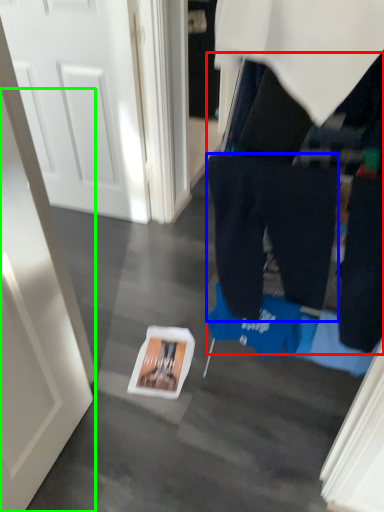
Question: Which object is positioned closest to tight (highlighted by a red box)? Select from trousers (highlighted by a blue box) and door (highlighted by a green box).

Choices:
 (A) trousers
 (B) door

Answer: (A)